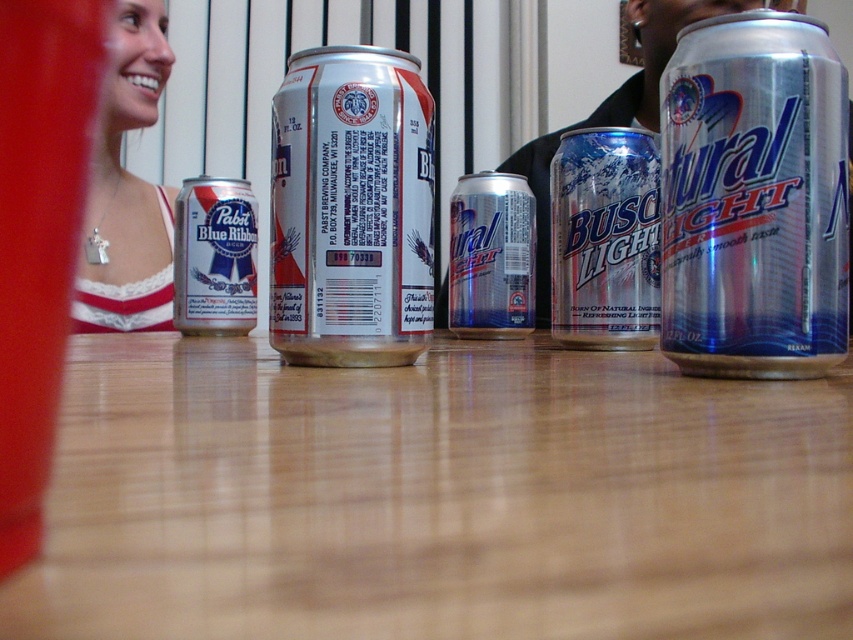
Between silver metallic can at right and metallic silver can at center, which one appears on the left side from the viewer's perspective?

From the viewer's perspective, metallic silver can at center appears more on the left side.

Who is positioned more to the right, silver metallic can at right or metallic silver can at center?

silver metallic can at right

The height and width of the screenshot is (640, 853). Find the location of `silver metallic can at right`. silver metallic can at right is located at coordinates (753, 198).

Locate an element on the screen. The image size is (853, 640). silver metallic can at right is located at coordinates (753, 198).

Does silver metallic busch light can at center have a larger size compared to matte silver can at left?

Correct, silver metallic busch light can at center is larger in size than matte silver can at left.

Who is shorter, silver metallic busch light can at center or matte silver can at left?

matte silver can at left

Image resolution: width=853 pixels, height=640 pixels. What do you see at coordinates (605, 240) in the screenshot? I see `silver metallic busch light can at center` at bounding box center [605, 240].

I want to click on silver metallic busch light can at center, so click(x=605, y=240).

Is silver metallic beer can at center further to camera compared to matte silver can at left?

No.

Does silver metallic beer can at center come in front of matte silver can at left?

Yes, it is.

Image resolution: width=853 pixels, height=640 pixels. What are the coordinates of `silver metallic beer can at center` in the screenshot? It's located at (351, 209).

Identify the location of silver metallic beer can at center. This screenshot has width=853, height=640. (351, 209).